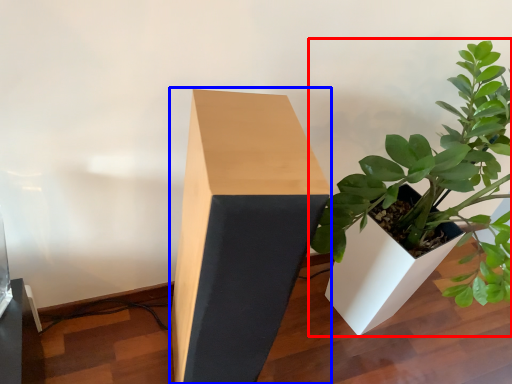
Question: Which of the following is the closest to the observer, houseplant (highlighted by a red box) or table (highlighted by a blue box)?

Choices:
 (A) houseplant
 (B) table

Answer: (A)